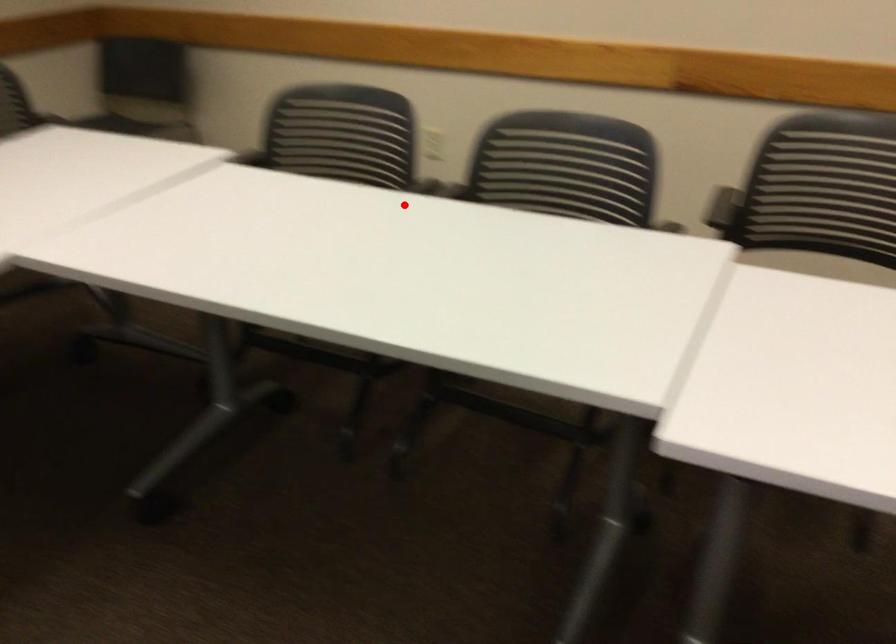
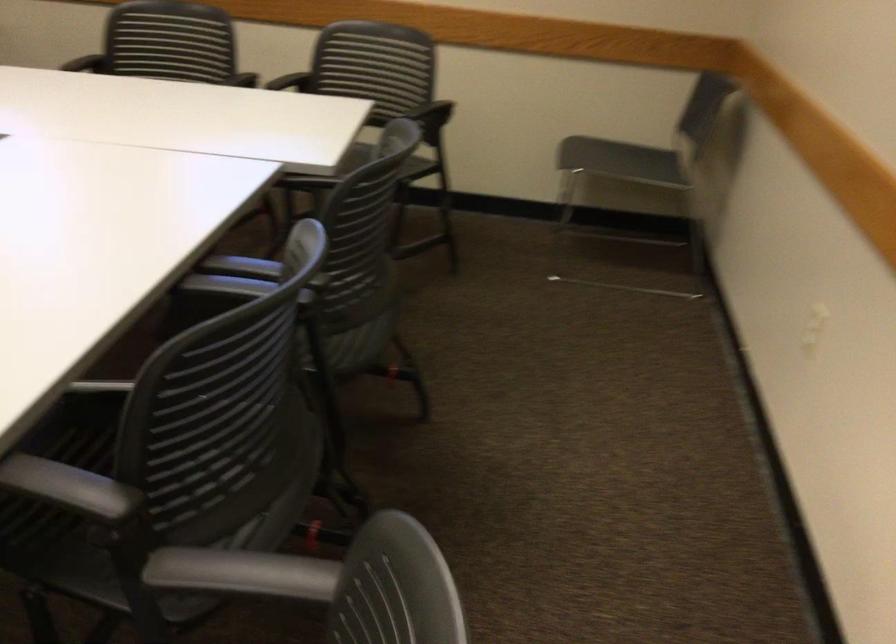
Find the pixel in the second image that matches the highlighted location in the first image.

(246, 274)